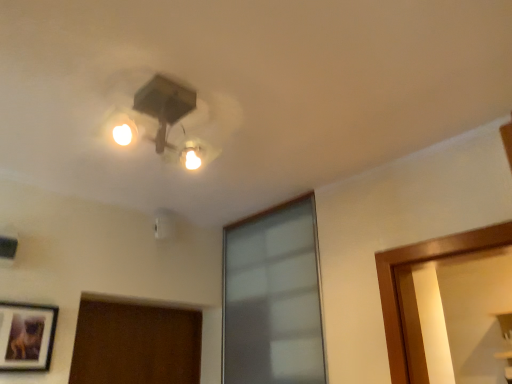
Question: Considering the relative sizes of frosted glass window at center and matte black picture frame at lower left in the image provided, is frosted glass window at center bigger than matte black picture frame at lower left?

Choices:
 (A) yes
 (B) no

Answer: (A)

Question: From the image's perspective, is frosted glass window at center beneath matte black picture frame at lower left?

Choices:
 (A) no
 (B) yes

Answer: (A)

Question: Is frosted glass window at center to the left of matte black picture frame at lower left from the viewer's perspective?

Choices:
 (A) yes
 (B) no

Answer: (B)

Question: Considering the relative sizes of frosted glass window at center and matte black picture frame at lower left in the image provided, is frosted glass window at center shorter than matte black picture frame at lower left?

Choices:
 (A) yes
 (B) no

Answer: (B)

Question: From a real-world perspective, is frosted glass window at center on top of matte black picture frame at lower left?

Choices:
 (A) no
 (B) yes

Answer: (B)

Question: From a real-world perspective, relative to matte black picture frame at lower left, is matte black fixture at upper center vertically above or below?

Choices:
 (A) above
 (B) below

Answer: (A)

Question: Based on their sizes in the image, would you say matte black fixture at upper center is bigger or smaller than matte black picture frame at lower left?

Choices:
 (A) small
 (B) big

Answer: (B)

Question: Is matte black fixture at upper center in front of or behind matte black picture frame at lower left in the image?

Choices:
 (A) behind
 (B) front

Answer: (B)

Question: Is matte black fixture at upper center wider or thinner than matte black picture frame at lower left?

Choices:
 (A) thin
 (B) wide

Answer: (B)

Question: Based on their positions, is frosted glass window at center located to the left or right of matte black fixture at upper center?

Choices:
 (A) right
 (B) left

Answer: (A)

Question: Does point (305, 231) appear closer or farther from the camera than point (208, 145)?

Choices:
 (A) closer
 (B) farther

Answer: (B)

Question: Looking at the image, does frosted glass window at center seem bigger or smaller compared to matte black fixture at upper center?

Choices:
 (A) big
 (B) small

Answer: (A)

Question: Would you say frosted glass window at center is inside or outside matte black fixture at upper center?

Choices:
 (A) inside
 (B) outside

Answer: (B)

Question: From a real-world perspective, relative to frosted glass window at center, is matte black picture frame at lower left vertically above or below?

Choices:
 (A) below
 (B) above

Answer: (A)

Question: Visually, is matte black picture frame at lower left positioned to the left or to the right of frosted glass window at center?

Choices:
 (A) right
 (B) left

Answer: (B)